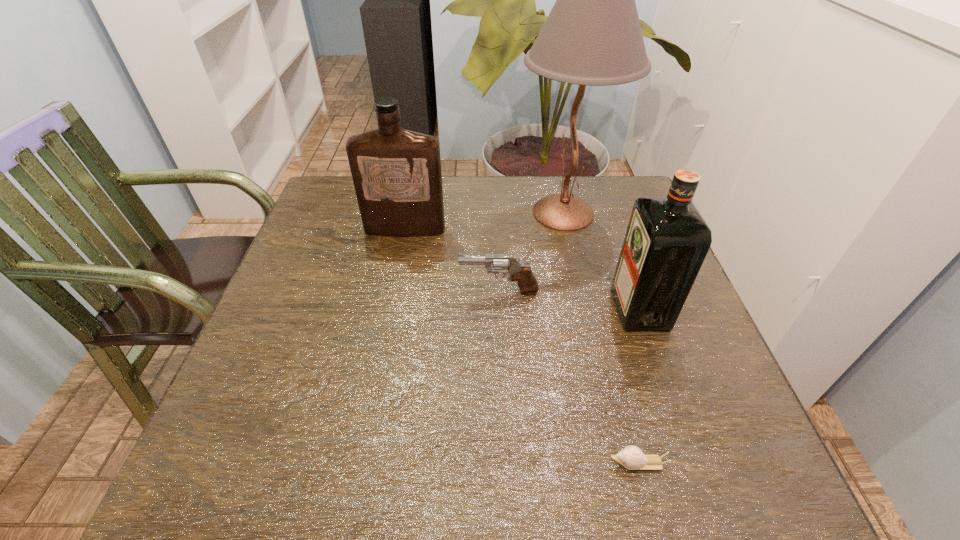
The height and width of the screenshot is (540, 960). In order to click on free space at the far edge of the desktop in this screenshot , I will do `click(477, 204)`.

Locate an element on the screen. free space at the near edge is located at coordinates (498, 451).

The height and width of the screenshot is (540, 960). Identify the location of free spot at the left edge of the desktop. (240, 374).

The height and width of the screenshot is (540, 960). I want to click on free space at the right edge of the desktop, so click(x=592, y=228).

At what (x,y) coordinates should I click in order to perform the action: click on vacant region at the far left corner of the desktop. Please return your answer as a coordinate pair (x, y). Image resolution: width=960 pixels, height=540 pixels. Looking at the image, I should click on (341, 178).

You are a GUI agent. You are given a task and a screenshot of the screen. Output one action in this format:
    pyautogui.click(x=<x>, y=<y>)
    Task: Click on the vacant area at the near right corner
    
    Given the screenshot: What is the action you would take?
    pyautogui.click(x=739, y=472)

Where is `free space that is in between the farther liquor and the table lamp`? The height and width of the screenshot is (540, 960). free space that is in between the farther liquor and the table lamp is located at coordinates (484, 221).

You are a GUI agent. You are given a task and a screenshot of the screen. Output one action in this format:
    pyautogui.click(x=<x>, y=<y>)
    Task: Click on the vacant area that lies between the pistol and the right liquor
    The width and height of the screenshot is (960, 540).
    Given the screenshot: What is the action you would take?
    pyautogui.click(x=569, y=300)

Image resolution: width=960 pixels, height=540 pixels. Find the location of `vacant point located between the leftmost object and the table lamp`. vacant point located between the leftmost object and the table lamp is located at coordinates (484, 221).

Image resolution: width=960 pixels, height=540 pixels. Find the location of `vacant space that's between the right liquor and the table lamp`. vacant space that's between the right liquor and the table lamp is located at coordinates (602, 260).